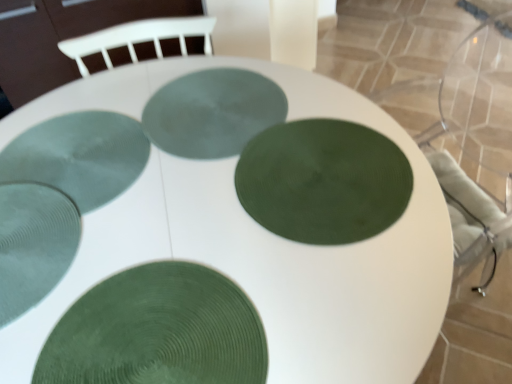
Question: Which direction should I rotate to look at green textured glass plate at center, positioned as the 2th glass plate in back-to-front order, — up or down?

Choices:
 (A) down
 (B) up

Answer: (B)

Question: Which direction should I rotate to look at green textured glass plate at center, positioned as the 3th glass plate in back-to-front order, — up or down?

Choices:
 (A) down
 (B) up

Answer: (B)

Question: Can you confirm if green textured glass plate at center, which ranks as the third glass plate in front-to-back order, is wider than green textured glass plate at center, which appears as the 5th glass plate when viewed from the front?

Choices:
 (A) no
 (B) yes

Answer: (B)

Question: Are green textured glass plate at center, which ranks as the third glass plate in front-to-back order, and green textured glass plate at center, which is the 1th glass plate in back-to-front order, making contact?

Choices:
 (A) yes
 (B) no

Answer: (B)

Question: Is green textured glass plate at center, positioned as the 3th glass plate in back-to-front order, far away from green textured glass plate at center, which is the 1th glass plate in back-to-front order?

Choices:
 (A) no
 (B) yes

Answer: (A)

Question: Can you confirm if green textured glass plate at center, positioned as the 3th glass plate in back-to-front order, is thinner than green textured glass plate at center, which appears as the 5th glass plate when viewed from the front?

Choices:
 (A) no
 (B) yes

Answer: (A)

Question: Is green textured glass plate at center, positioned as the 3th glass plate in back-to-front order, in front of green textured glass plate at center, which appears as the 5th glass plate when viewed from the front?

Choices:
 (A) yes
 (B) no

Answer: (A)

Question: From the image's perspective, would you say green textured glass plate at center, positioned as the 3th glass plate in back-to-front order, is positioned over green textured glass plate at center, which is the 1th glass plate in back-to-front order?

Choices:
 (A) no
 (B) yes

Answer: (A)

Question: Is clear textured glass at bottom left, the fourth glass plate from the back, next to green textured glass plate at center, which is the 1th glass plate in back-to-front order?

Choices:
 (A) no
 (B) yes

Answer: (A)

Question: Does clear textured glass at bottom left, the fourth glass plate from the back, have a greater width compared to green textured glass plate at center, which appears as the 5th glass plate when viewed from the front?

Choices:
 (A) no
 (B) yes

Answer: (A)

Question: Is clear textured glass at bottom left, the fourth glass plate from the back, far from green textured glass plate at center, which is the 1th glass plate in back-to-front order?

Choices:
 (A) yes
 (B) no

Answer: (B)

Question: Is clear textured glass at bottom left, positioned as the 2th glass plate in front-to-back order, facing away from green textured glass plate at center, which is the 1th glass plate in back-to-front order?

Choices:
 (A) yes
 (B) no

Answer: (A)

Question: Is clear textured glass at bottom left, the fourth glass plate from the back, further to the viewer compared to green textured glass plate at center, which is the 1th glass plate in back-to-front order?

Choices:
 (A) no
 (B) yes

Answer: (A)

Question: Does clear textured glass at bottom left, positioned as the 2th glass plate in front-to-back order, have a larger size compared to green textured glass plate at center, which is the 1th glass plate in back-to-front order?

Choices:
 (A) no
 (B) yes

Answer: (B)

Question: From the image's perspective, is green textured glass plate at center, arranged as the fourth glass plate when viewed from the front, located beneath green textured plate at center, which is the 5th glass plate from back to front?

Choices:
 (A) yes
 (B) no

Answer: (B)